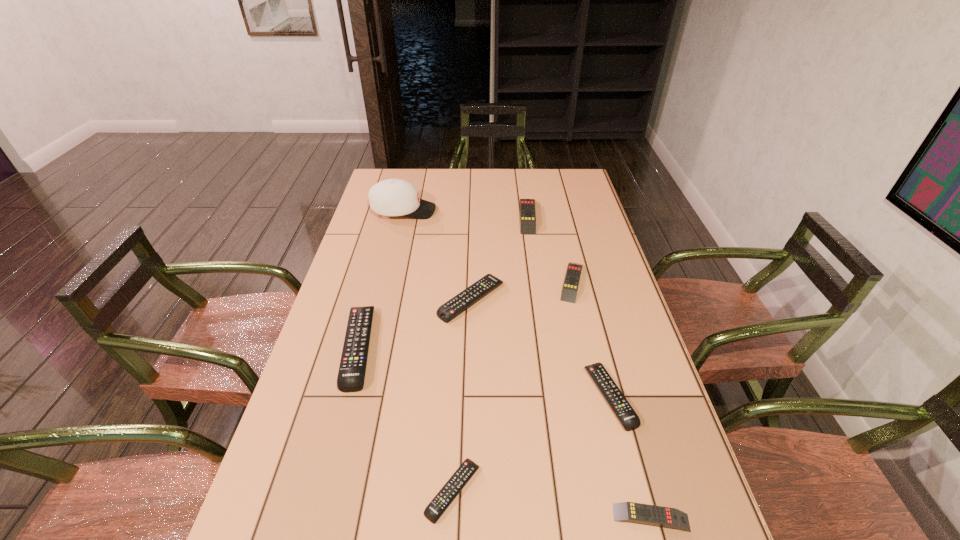
Locate an element on the screen. This screenshot has width=960, height=540. yellow remote control that is the second closest to the fourth remote control from right to left is located at coordinates (661, 516).

Find the location of a particular element. The width and height of the screenshot is (960, 540). the second closest black remote control to the second biggest black remote control is located at coordinates (621, 407).

Select which black remote control is the closest to the leftmost black remote control. Please provide its 2D coordinates. Your answer should be formatted as a tuple, i.e. [(x, y)], where the tuple contains the x and y coordinates of a point satisfying the conditions above.

[(449, 310)]

The width and height of the screenshot is (960, 540). In order to click on vacant space that satisfies the following two spatial constraints: 1. on the front-facing side of the white baseball cap; 2. on the left side of the shortest remote control in this screenshot , I will do `click(337, 490)`.

You are a GUI agent. You are given a task and a screenshot of the screen. Output one action in this format:
    pyautogui.click(x=<x>, y=<y>)
    Task: Click on the vacant space that satisfies the following two spatial constraints: 1. on the back side of the nearest black remote control; 2. on the front-facing side of the white baseball cap
    
    Given the screenshot: What is the action you would take?
    pyautogui.click(x=466, y=211)

The height and width of the screenshot is (540, 960). In order to click on vacant point that satisfies the following two spatial constraints: 1. on the back side of the shortest remote control; 2. on the left side of the third biggest black remote control in this screenshot , I will do `click(457, 396)`.

Where is `free location that satisfies the following two spatial constraints: 1. on the front-facing side of the second biggest black remote control; 2. on the right side of the baseball cap`? Image resolution: width=960 pixels, height=540 pixels. free location that satisfies the following two spatial constraints: 1. on the front-facing side of the second biggest black remote control; 2. on the right side of the baseball cap is located at coordinates (382, 300).

Where is `free spot that satisfies the following two spatial constraints: 1. on the front side of the rightmost black remote control; 2. on the left side of the second biggest black remote control`? free spot that satisfies the following two spatial constraints: 1. on the front side of the rightmost black remote control; 2. on the left side of the second biggest black remote control is located at coordinates (469, 396).